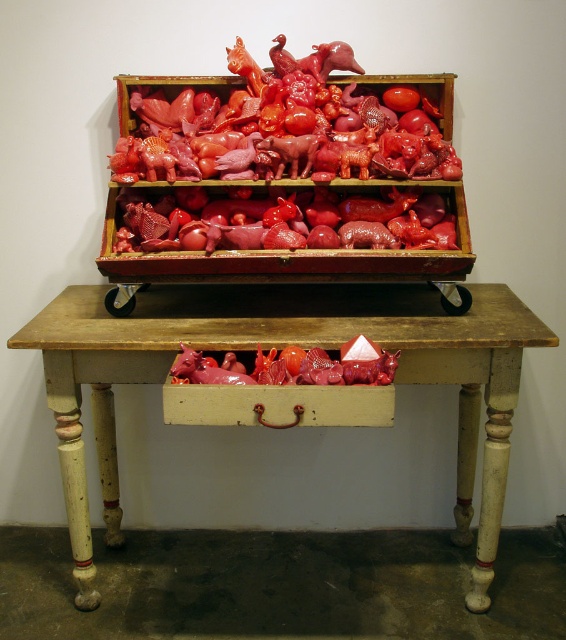
Question: Which point is farther to the camera?

Choices:
 (A) (275, 358)
 (B) (70, 301)
 (C) (428, 232)
 (D) (415, 88)

Answer: (B)

Question: Is wooden table at center closer to camera compared to glossy plastic tomato at upper center?

Choices:
 (A) yes
 (B) no

Answer: (A)

Question: Which object is the closest to the glossy plastic tomato at upper center?

Choices:
 (A) wooden table at center
 (B) glossy plastic box at center
 (C) glossy plastic tomato at center

Answer: (B)

Question: Considering the relative positions of glossy plastic tomato at center and glossy plastic tomato at upper center in the image provided, where is glossy plastic tomato at center located with respect to glossy plastic tomato at upper center?

Choices:
 (A) above
 (B) below

Answer: (B)

Question: Does glossy plastic tomato at center lie in front of glossy plastic tomato at upper center?

Choices:
 (A) no
 (B) yes

Answer: (B)

Question: Which object appears closest to the camera in this image?

Choices:
 (A) glossy plastic tomato at upper center
 (B) wooden table at center

Answer: (B)